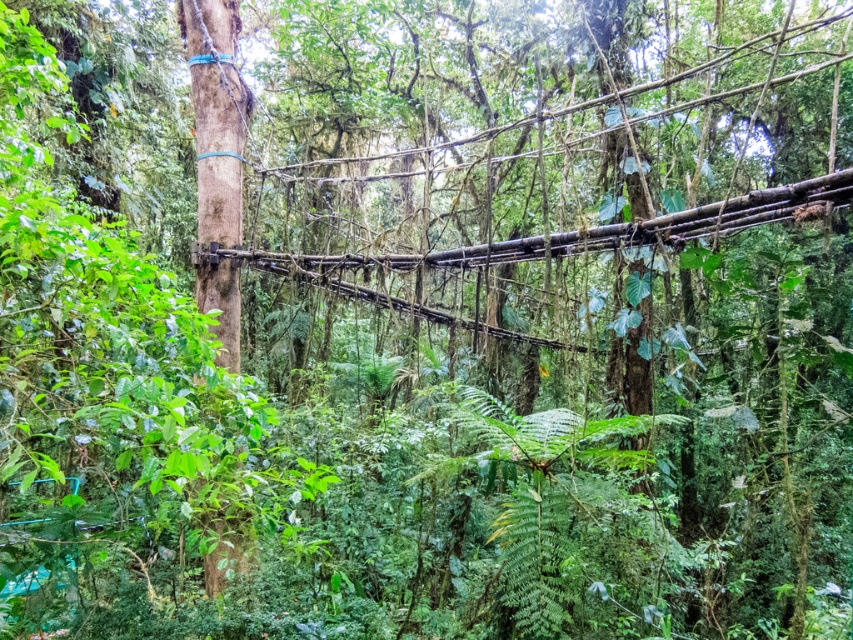
Does brown woven rope bridge at center appear under smooth brown tree trunk at center?

Yes, brown woven rope bridge at center is below smooth brown tree trunk at center.

Who is positioned more to the left, brown woven rope bridge at center or smooth brown tree trunk at center?

smooth brown tree trunk at center is more to the left.

Find the location of `brown woven rope bridge at center`. brown woven rope bridge at center is located at coordinates click(x=560, y=244).